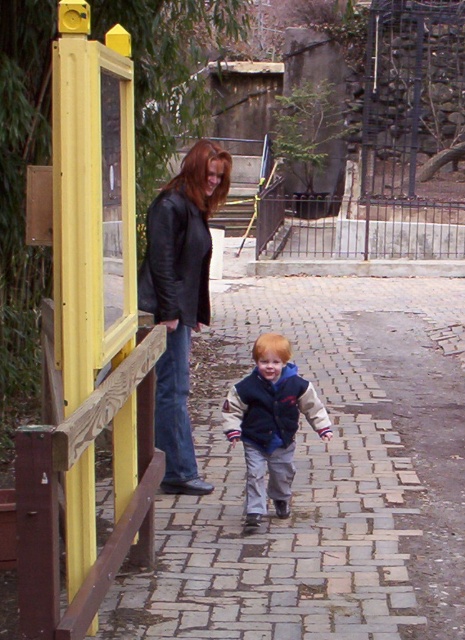
Is wooden rail at left smaller than velvet blue jacket at center?

Actually, wooden rail at left might be larger than velvet blue jacket at center.

Who is more forward, (139, 353) or (268, 433)?

Point (139, 353) is in front.

Locate an element on the screen. The width and height of the screenshot is (465, 640). wooden rail at left is located at coordinates (57, 499).

In the scene shown: Who is more distant from viewer, (x=106, y=380) or (x=192, y=296)?

The point (x=192, y=296) is behind.

Find the location of a particular element. wooden rail at left is located at coordinates (57, 499).

Between point (46, 556) and point (199, 259), which one is positioned in front?

Positioned in front is point (46, 556).

Find the location of a particular element. This screenshot has height=640, width=465. wooden rail at left is located at coordinates (57, 499).

Can you confirm if wooden rail at left is positioned below matte black leather jacket at upper left?

Yes.

Does point (75, 422) come farther from viewer compared to point (184, 330)?

No.

The image size is (465, 640). I want to click on wooden rail at left, so click(57, 499).